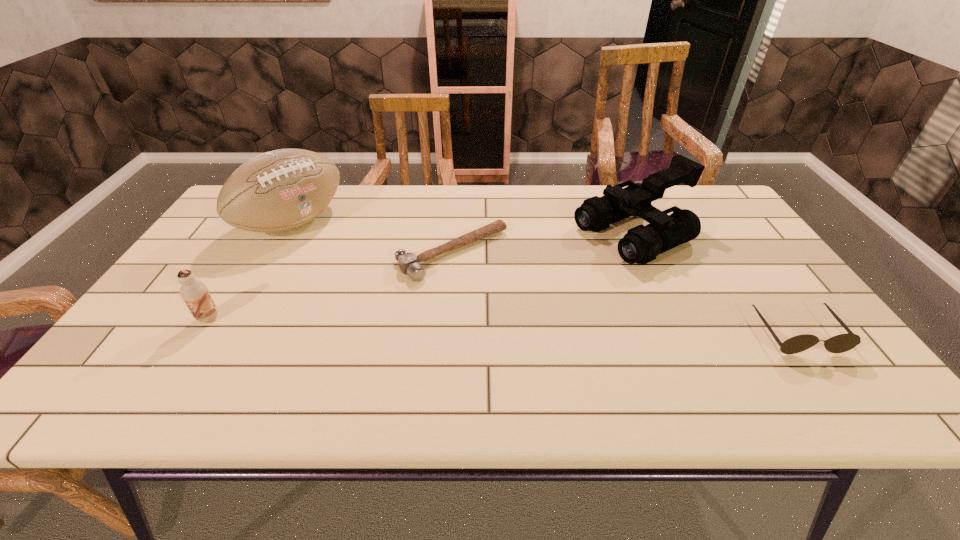
The width and height of the screenshot is (960, 540). I want to click on the third tallest object, so click(x=195, y=294).

Image resolution: width=960 pixels, height=540 pixels. Find the location of `the rightmost object`. the rightmost object is located at coordinates (841, 343).

Where is `sunglasses`? The height and width of the screenshot is (540, 960). sunglasses is located at coordinates (841, 343).

You are a GUI agent. You are given a task and a screenshot of the screen. Output one action in this format:
    pyautogui.click(x=<x>, y=<y>)
    Task: Click on the football (American)
    Image resolution: width=960 pixels, height=540 pixels.
    Given the screenshot: What is the action you would take?
    pyautogui.click(x=280, y=190)

Where is `the shortest object`? This screenshot has height=540, width=960. the shortest object is located at coordinates (408, 263).

In order to click on hammer in this screenshot , I will do `click(408, 263)`.

Find the location of a particular element. The image size is (960, 540). the second object from right to left is located at coordinates (641, 244).

Find the location of a particular element. the fourth shortest object is located at coordinates (641, 244).

The height and width of the screenshot is (540, 960). In order to click on free region located on the left of the chocolate milk in this screenshot , I will do `click(159, 319)`.

The height and width of the screenshot is (540, 960). I want to click on free space located on the laces of the football (American), so click(x=365, y=270).